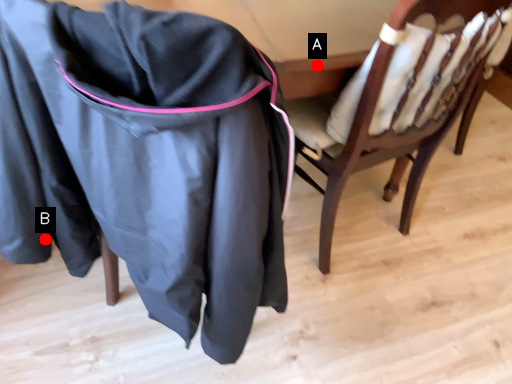
Question: Two points are circled on the image, labeled by A and B beside each circle. Which point is farther to the camera?

Choices:
 (A) A is further
 (B) B is further

Answer: (A)